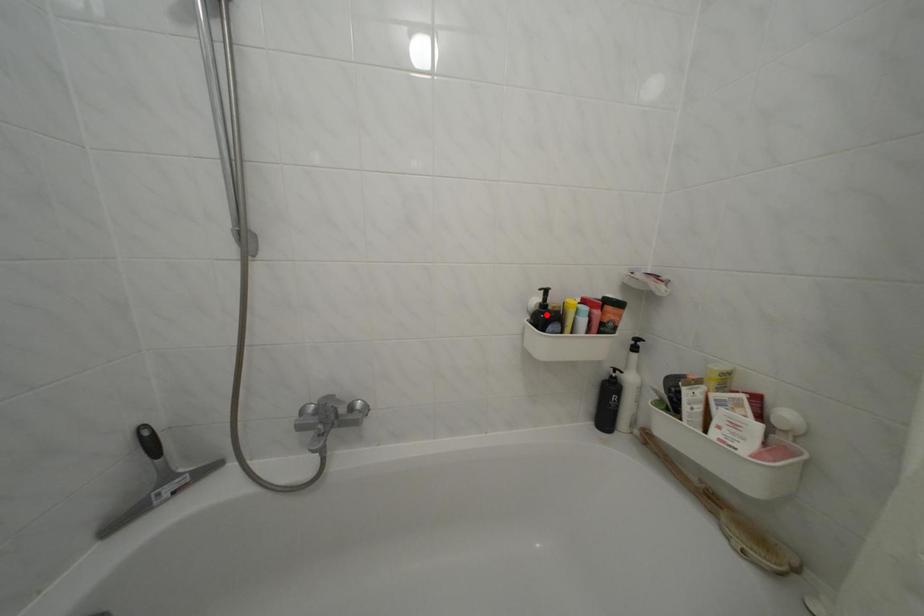
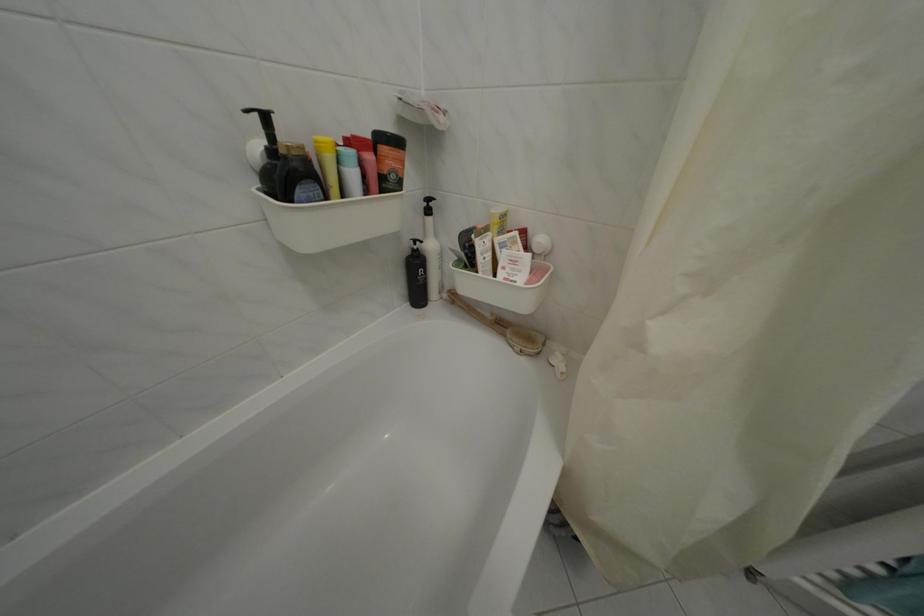
Question: I am providing you with two images of the same scene from different viewpoints. A red point is marked on the first image. Can you still see the location of the red point in image 2?

Choices:
 (A) Yes
 (B) No

Answer: (A)